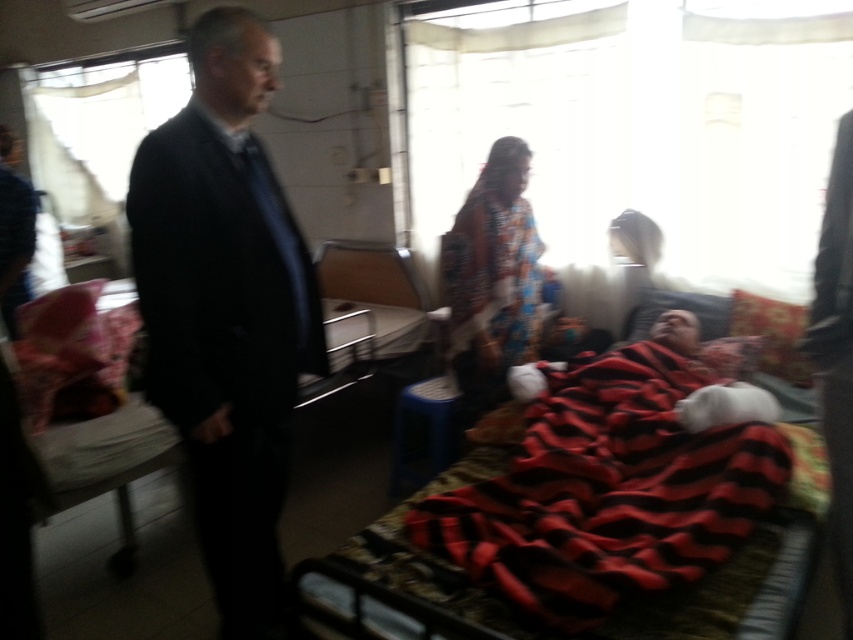
Does red striped fabric at lower right have a greater height compared to printed fabric dress at center?

Incorrect, red striped fabric at lower right's height is not larger of printed fabric dress at center's.

The width and height of the screenshot is (853, 640). What are the coordinates of `red striped fabric at lower right` in the screenshot? It's located at (608, 492).

Image resolution: width=853 pixels, height=640 pixels. What are the coordinates of `red striped fabric at lower right` in the screenshot? It's located at (608, 492).

Which of these two, black suit at left or printed fabric dress at center, stands taller?

black suit at left is taller.

Which is below, black suit at left or printed fabric dress at center?

black suit at left is below.

Does point (267, 36) come behind point (517, 163)?

No.

You are a GUI agent. You are given a task and a screenshot of the screen. Output one action in this format:
    pyautogui.click(x=<x>, y=<y>)
    Task: Click on the black suit at left
    Image resolution: width=853 pixels, height=640 pixels.
    Given the screenshot: What is the action you would take?
    pyautogui.click(x=225, y=310)

Is black suit at left bigger than red striped fabric at lower right?

No.

Is point (253, 38) positioned behind point (495, 588)?

Yes, point (253, 38) is behind point (495, 588).

Where is `black suit at left`? The width and height of the screenshot is (853, 640). black suit at left is located at coordinates (225, 310).